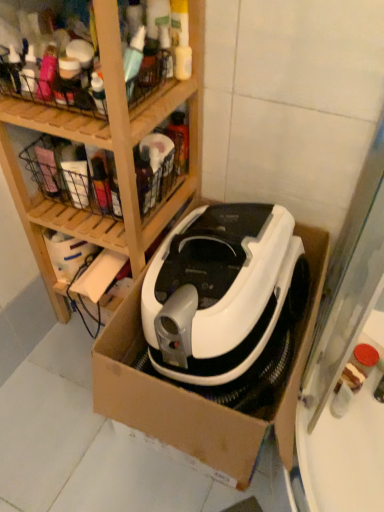
What is the approximate width of white plastic vacuum cleaner at center?

It is 21.64 inches.

I want to click on white cardboard box at center, so click(212, 387).

Would you say metallic wire basket at upper left is a long distance from white plastic vacuum cleaner at center?

No, there isn't a large distance between metallic wire basket at upper left and white plastic vacuum cleaner at center.

Is metallic wire basket at upper left oriented away from white plastic vacuum cleaner at center?

No, metallic wire basket at upper left is not facing the opposite direction of white plastic vacuum cleaner at center.

Is metallic wire basket at upper left bigger than white plastic vacuum cleaner at center?

No.

Is white plastic vacuum cleaner at center inside white cardboard box at center?

Yes, white cardboard box at center contains white plastic vacuum cleaner at center.

Between point (305, 361) and point (288, 246), which one is positioned behind?

Positioned behind is point (288, 246).

Can you confirm if white cardboard box at center is thinner than white plastic vacuum cleaner at center?

In fact, white cardboard box at center might be wider than white plastic vacuum cleaner at center.

Could you tell me if white cardboard box at center is turned towards white plastic vacuum cleaner at center?

Yes, white cardboard box at center is turned towards white plastic vacuum cleaner at center.

Would you consider wooden at upper left to be distant from white cardboard box at center?

wooden at upper left is near white cardboard box at center, not far away.

Is wooden at upper left aimed at white cardboard box at center?

No, wooden at upper left is not turned towards white cardboard box at center.

Locate an element on the screen. Image resolution: width=384 pixels, height=512 pixels. cardboard box below the wooden at upper left (from a real-world perspective) is located at coordinates (212, 387).

From a real-world perspective, is wooden at upper left physically located above or below white cardboard box at center?

From a real-world perspective, wooden at upper left is physically above white cardboard box at center.

Identify the location of basket lying above the white plastic vacuum cleaner at center (from the image's perspective). (50, 88).

From their relative heights in the image, would you say white plastic vacuum cleaner at center is taller or shorter than metallic wire basket at upper left?

Considering their sizes, white plastic vacuum cleaner at center has more height than metallic wire basket at upper left.

Considering the relative sizes of white plastic vacuum cleaner at center and metallic wire basket at upper left in the image provided, is white plastic vacuum cleaner at center thinner than metallic wire basket at upper left?

No, white plastic vacuum cleaner at center is not thinner than metallic wire basket at upper left.

How distant is white plastic vacuum cleaner at center from metallic wire basket at upper left?

white plastic vacuum cleaner at center and metallic wire basket at upper left are 18.05 inches apart.

Considering the positions of points (154, 389) and (84, 133), is point (154, 389) farther from camera compared to point (84, 133)?

That is False.

Which is in front, white cardboard box at center or wooden at upper left?

wooden at upper left is closer to the camera.

Which object is thinner, white cardboard box at center or wooden at upper left?

wooden at upper left is thinner.

Would you say white plastic vacuum cleaner at center is outside wooden at upper left?

white plastic vacuum cleaner at center is positioned outside wooden at upper left.

Measure the distance from white plastic vacuum cleaner at center to wooden at upper left.

white plastic vacuum cleaner at center and wooden at upper left are 25.02 centimeters apart from each other.

Is wooden at upper left at the back of white plastic vacuum cleaner at center?

That's not correct — white plastic vacuum cleaner at center is not looking away from wooden at upper left.

Is point (272, 301) behind point (115, 82)?

Yes, it is behind point (115, 82).

Find the location of a particular element. The image size is (384, 512). shelf that appears above the white plastic vacuum cleaner at center (from the image's perspective) is located at coordinates (108, 147).

Is wooden at upper left oriented away from white plastic vacuum cleaner at center?

wooden at upper left is not turned away from white plastic vacuum cleaner at center.

In the scene shown: How many degrees apart are the facing directions of wooden at upper left and white plastic vacuum cleaner at center?

The angular difference between wooden at upper left and white plastic vacuum cleaner at center is 1.8 degrees.

From the image's perspective, does wooden at upper left appear lower than white plastic vacuum cleaner at center?

Actually, wooden at upper left appears above white plastic vacuum cleaner at center in the image.

The image size is (384, 512). Find the location of `basket located on the left of white plastic vacuum cleaner at center`. basket located on the left of white plastic vacuum cleaner at center is located at coordinates (50, 88).

You are a GUI agent. You are given a task and a screenshot of the screen. Output one action in this format:
    pyautogui.click(x=<x>, y=<y>)
    Task: Click on the cardboard box beneath the white plastic vacuum cleaner at center (from a real-world perspective)
    The width and height of the screenshot is (384, 512).
    Given the screenshot: What is the action you would take?
    pyautogui.click(x=212, y=387)

From the image, which object appears to be nearer to white plastic vacuum cleaner at center, metallic wire basket at upper left or white cardboard box at center?

white cardboard box at center is positioned closer to the anchor white plastic vacuum cleaner at center.

Looking at the image, which one is located further to white plastic vacuum cleaner at center, metallic wire basket at upper left or wooden at upper left?

metallic wire basket at upper left is positioned further to the anchor white plastic vacuum cleaner at center.

Estimate the real-world distances between objects in this image. Which object is closer to wooden at upper left, white cardboard box at center or metallic wire basket at upper left?

metallic wire basket at upper left is closer to wooden at upper left.

Looking at the image, which one is located closer to white plastic vacuum cleaner at center, wooden at upper left or metallic wire basket at upper left?

Based on the image, wooden at upper left appears to be nearer to white plastic vacuum cleaner at center.

In the scene shown: From the image, which object appears to be nearer to white cardboard box at center, metallic wire basket at upper left or white plastic vacuum cleaner at center?

white plastic vacuum cleaner at center is positioned closer to the anchor white cardboard box at center.

Considering their positions, is white cardboard box at center positioned further to white plastic vacuum cleaner at center than metallic wire basket at upper left?

metallic wire basket at upper left lies further to white plastic vacuum cleaner at center than the other object.

When comparing their distances from metallic wire basket at upper left, does white cardboard box at center or white plastic vacuum cleaner at center seem further?

Based on the image, white cardboard box at center appears to be further to metallic wire basket at upper left.

Based on their spatial positions, is white plastic vacuum cleaner at center or metallic wire basket at upper left closer to white cardboard box at center?

Among the two, white plastic vacuum cleaner at center is located nearer to white cardboard box at center.

Locate an element on the screen. The width and height of the screenshot is (384, 512). home appliance between metallic wire basket at upper left and white cardboard box at center vertically is located at coordinates (218, 291).

Locate an element on the screen. shelf between metallic wire basket at upper left and white cardboard box at center in the up-down direction is located at coordinates (108, 147).

Find the location of a particular element. The width and height of the screenshot is (384, 512). home appliance that lies between wooden at upper left and white cardboard box at center from top to bottom is located at coordinates (218, 291).

You are a GUI agent. You are given a task and a screenshot of the screen. Output one action in this format:
    pyautogui.click(x=<x>, y=<y>)
    Task: Click on the shelf between metallic wire basket at upper left and white plastic vacuum cleaner at center in the vertical direction
    
    Given the screenshot: What is the action you would take?
    pyautogui.click(x=108, y=147)